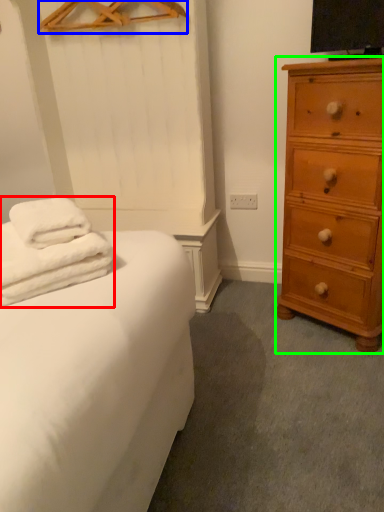
Question: Considering the real-world distances, which object is closest to bath towel (highlighted by a red box)? hanger (highlighted by a blue box) or chest of drawers (highlighted by a green box).

Choices:
 (A) hanger
 (B) chest of drawers

Answer: (B)